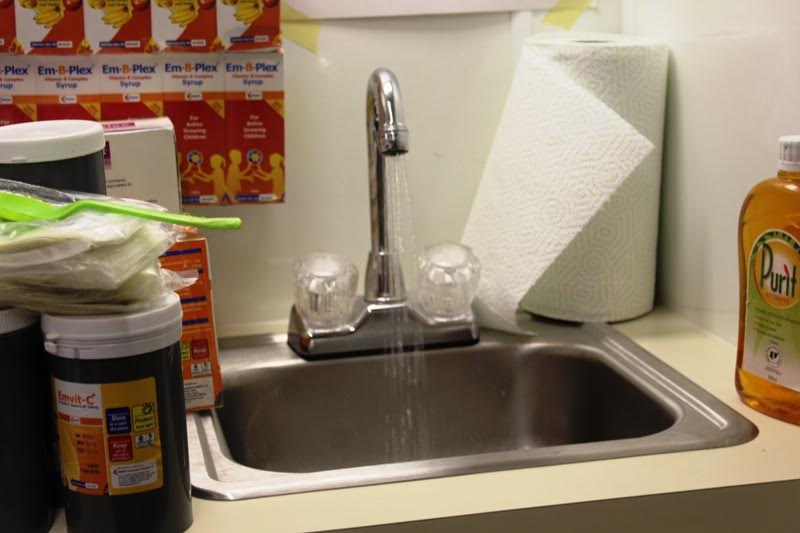
You are a GUI agent. You are given a task and a screenshot of the screen. Output one action in this format:
    pyautogui.click(x=<x>, y=<y>)
    Task: Click on the walls
    This screenshot has width=800, height=533.
    Given the screenshot: What is the action you would take?
    pyautogui.click(x=721, y=141), pyautogui.click(x=426, y=129)